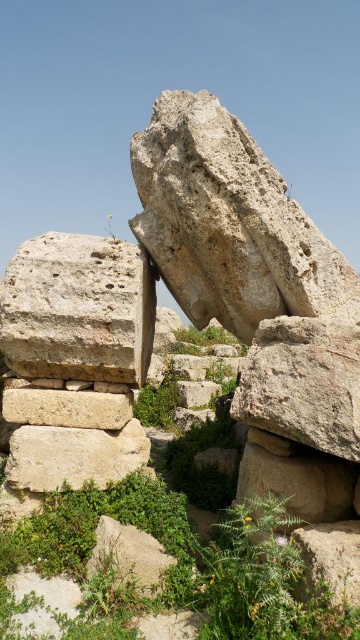
Question: Is gray rough stone at center positioned behind beige stone at center?

Choices:
 (A) no
 (B) yes

Answer: (A)

Question: Is gray rough stone at center smaller than beige stone at center?

Choices:
 (A) no
 (B) yes

Answer: (A)

Question: Can you confirm if gray rough stone at center is bigger than beige stone at center?

Choices:
 (A) no
 (B) yes

Answer: (B)